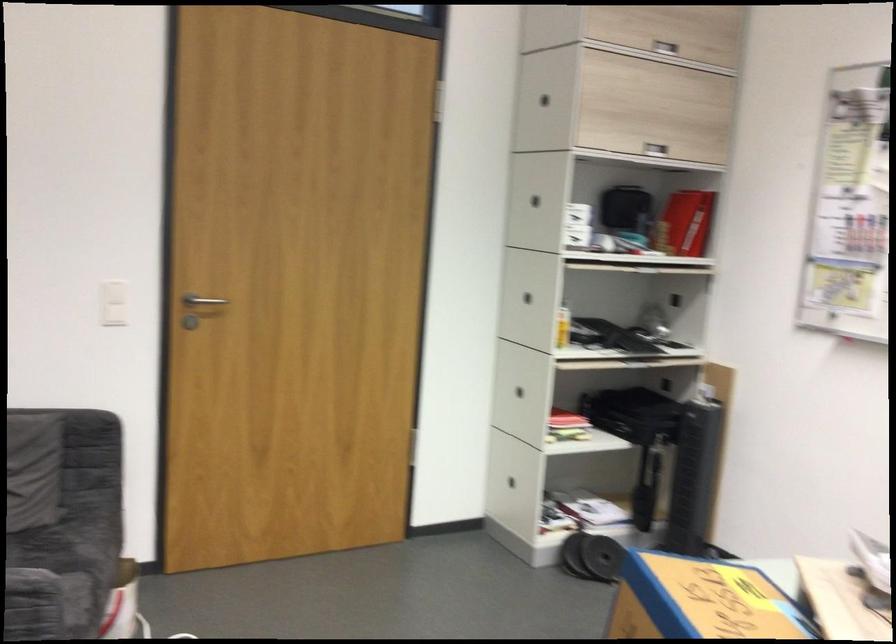
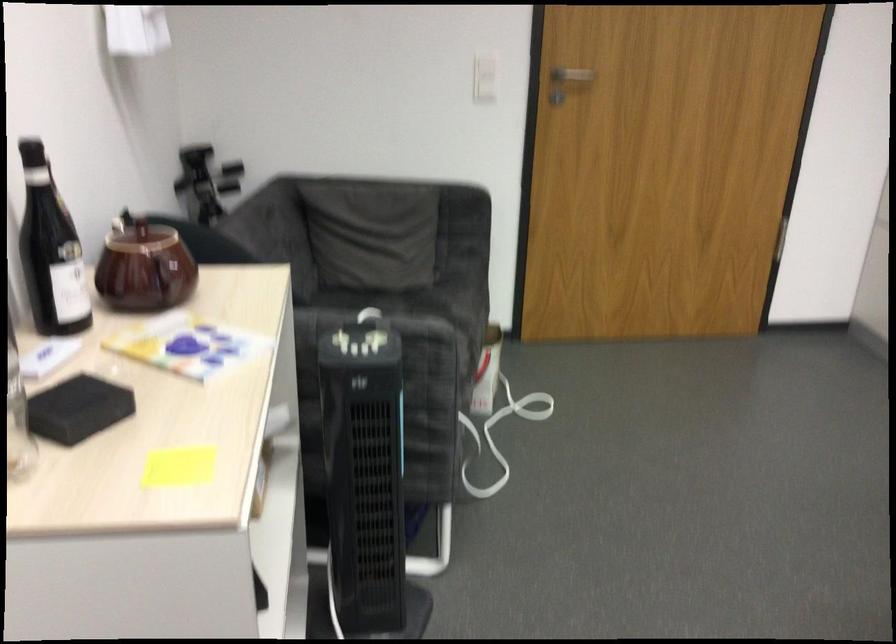
The images are taken continuously from a first-person perspective. In which direction is your viewpoint rotating?

The camera rotated toward left-down.